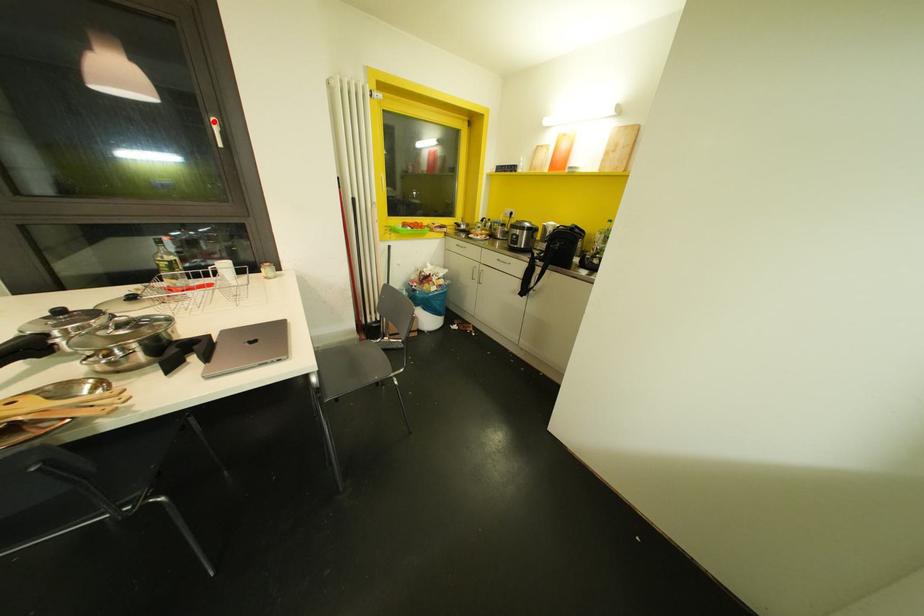
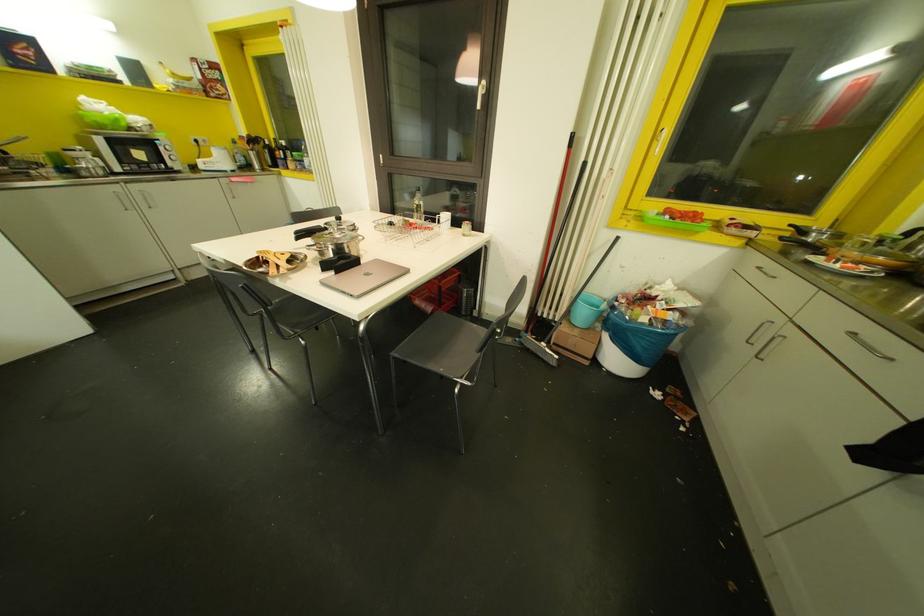
The point at the highlighted location is marked in the first image. Where is the corresponding point in the second image?

(481, 81)